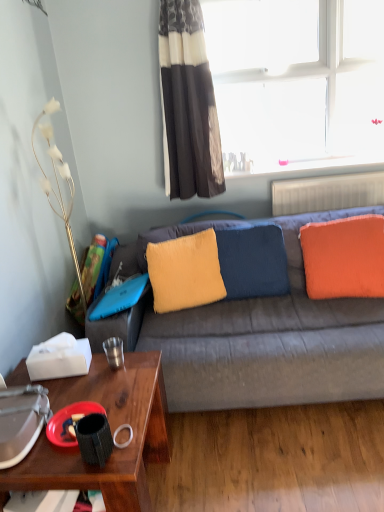
This screenshot has height=512, width=384. Describe the element at coordinates (188, 104) in the screenshot. I see `black and white striped curtain at upper center` at that location.

Locate an element on the screen. The width and height of the screenshot is (384, 512). black textured coffee cup at lower left, the first coffee cup in the front-to-back sequence is located at coordinates (94, 438).

Describe the element at coordinates (327, 193) in the screenshot. I see `white plastic radiator at upper right` at that location.

The height and width of the screenshot is (512, 384). What do you see at coordinates (253, 261) in the screenshot? I see `velvety yellow pillow at center, which appears as the 2th pillow when viewed from the left` at bounding box center [253, 261].

How much space does orange soft cushion at right, marked as the 3th pillow in a left-to-right arrangement, occupy horizontally?

The width of orange soft cushion at right, marked as the 3th pillow in a left-to-right arrangement, is 4.92 inches.

Where is `black and white striped curtain at upper center`? The width and height of the screenshot is (384, 512). black and white striped curtain at upper center is located at coordinates (188, 104).

Is transparent glass window at upper right positioned in front of black textured coffee cup at lower left, arranged as the 2th coffee cup when viewed from the back?

No, transparent glass window at upper right is behind black textured coffee cup at lower left, arranged as the 2th coffee cup when viewed from the back.

Is the surface of transparent glass window at upper right in direct contact with black textured coffee cup at lower left, the first coffee cup in the bottom-to-top sequence?

There is a gap between transparent glass window at upper right and black textured coffee cup at lower left, the first coffee cup in the bottom-to-top sequence.

This screenshot has height=512, width=384. I want to click on the 2nd coffee cup in front when counting from the transparent glass window at upper right, so click(x=94, y=438).

How many degrees apart are the facing directions of black and white striped curtain at upper center and black textured coffee cup at lower left, the first coffee cup in the bottom-to-top sequence?

black and white striped curtain at upper center and black textured coffee cup at lower left, the first coffee cup in the bottom-to-top sequence, are facing 86.9 degrees away from each other.

Relative to black textured coffee cup at lower left, arranged as the 2th coffee cup when viewed from the back, is black and white striped curtain at upper center in front or behind?

black and white striped curtain at upper center is positioned farther from the viewer than black textured coffee cup at lower left, arranged as the 2th coffee cup when viewed from the back.

From the image's perspective, which is below, black and white striped curtain at upper center or black textured coffee cup at lower left, which is counted as the second coffee cup, starting from the top?

black textured coffee cup at lower left, which is counted as the second coffee cup, starting from the top, from the image's perspective.

Which is more distant, [172,9] or [91,448]?

Point [172,9]

The height and width of the screenshot is (512, 384). Identify the location of curtain lying on the right of metallic silver cup at lower left, the 1th coffee cup positioned from the back. (188, 104).

Is metallic silver cup at lower left, the 1th coffee cup positioned from the back, next to black and white striped curtain at upper center and touching it?

No, metallic silver cup at lower left, the 1th coffee cup positioned from the back, is not in contact with black and white striped curtain at upper center.

Is metallic silver cup at lower left, the first coffee cup from the top, oriented away from black and white striped curtain at upper center?

metallic silver cup at lower left, the first coffee cup from the top, does not have its back to black and white striped curtain at upper center.

Between metallic silver cup at lower left, marked as the 2th coffee cup in a front-to-back arrangement, and black and white striped curtain at upper center, which one has less height?

metallic silver cup at lower left, marked as the 2th coffee cup in a front-to-back arrangement.

Which object is wider, black textured coffee cup at lower left, which is counted as the second coffee cup, starting from the top, or transparent glass window at upper right?

black textured coffee cup at lower left, which is counted as the second coffee cup, starting from the top.

Who is taller, black textured coffee cup at lower left, which is counted as the second coffee cup, starting from the top, or transparent glass window at upper right?

With more height is transparent glass window at upper right.

From the image's perspective, which one is positioned lower, black textured coffee cup at lower left, the first coffee cup in the bottom-to-top sequence, or transparent glass window at upper right?

black textured coffee cup at lower left, the first coffee cup in the bottom-to-top sequence, is shown below in the image.

Is transparent glass window at upper right surrounded by black textured coffee cup at lower left, which is counted as the second coffee cup, starting from the top?

Definitely not — transparent glass window at upper right is not inside black textured coffee cup at lower left, which is counted as the second coffee cup, starting from the top.

Is point (378, 290) closer to camera compared to point (153, 259)?

Yes, point (378, 290) is in front of point (153, 259).

Is orange soft cushion at right, marked as the 3th pillow in a left-to-right arrangement, shorter than fuzzy yellow pillow at center, marked as the 1th pillow in a left-to-right arrangement?

No.

Is orange soft cushion at right, marked as the 3th pillow in a left-to-right arrangement, completely or partially outside of fuzzy yellow pillow at center, marked as the 1th pillow in a left-to-right arrangement?

That's correct, orange soft cushion at right, marked as the 3th pillow in a left-to-right arrangement, is outside of fuzzy yellow pillow at center, marked as the 1th pillow in a left-to-right arrangement.

How different are the orientations of orange soft cushion at right, the 1th pillow viewed from the right, and fuzzy yellow pillow at center, arranged as the third pillow when viewed from the right, in degrees?

30.3 degrees separate the facing orientations of orange soft cushion at right, the 1th pillow viewed from the right, and fuzzy yellow pillow at center, arranged as the third pillow when viewed from the right.

Visually, is white metallic lamp at left positioned to the left or to the right of fuzzy yellow pillow at center, arranged as the third pillow when viewed from the right?

white metallic lamp at left is positioned on fuzzy yellow pillow at center, arranged as the third pillow when viewed from the right,'s left side.

From the picture: What's the angular difference between white metallic lamp at left and fuzzy yellow pillow at center, marked as the 1th pillow in a left-to-right arrangement,'s facing directions?

72.5 degrees separate the facing orientations of white metallic lamp at left and fuzzy yellow pillow at center, marked as the 1th pillow in a left-to-right arrangement.

Is white metallic lamp at left bigger or smaller than fuzzy yellow pillow at center, arranged as the third pillow when viewed from the right?

white metallic lamp at left is bigger than fuzzy yellow pillow at center, arranged as the third pillow when viewed from the right.

Which is nearer, (54, 110) or (158, 283)?

Point (54, 110) is farther from the camera than point (158, 283).

From the image's perspective, is transparent glass window at upper right below white metallic lamp at left?

No.

Does transparent glass window at upper right have a larger size compared to white metallic lamp at left?

Yes.

From the picture: Is the surface of transparent glass window at upper right in direct contact with white metallic lamp at left?

No, transparent glass window at upper right is not in contact with white metallic lamp at left.

Does point (277, 58) lie behind point (72, 250)?

Yes, point (277, 58) is behind point (72, 250).

At what (x,y) coordinates should I click in order to perform the action: click on window that is behind the black textured coffee cup at lower left, the first coffee cup in the bottom-to-top sequence. Please return your answer as a coordinate pair (x, y). The image size is (384, 512). Looking at the image, I should click on (295, 78).

Where is `the 1st coffee cup counting from the left of the black and white striped curtain at upper center`? This screenshot has width=384, height=512. the 1st coffee cup counting from the left of the black and white striped curtain at upper center is located at coordinates (94, 438).

Estimate the real-world distances between objects in this image. Which object is further from white plastic radiator at upper right, black and white striped curtain at upper center or fuzzy yellow pillow at center, marked as the 1th pillow in a left-to-right arrangement?

fuzzy yellow pillow at center, marked as the 1th pillow in a left-to-right arrangement.

When comparing their distances from orange soft cushion at right, marked as the 3th pillow in a left-to-right arrangement, does black textured coffee cup at lower left, the first coffee cup in the front-to-back sequence, or transparent glass window at upper right seem closer?

Answer: The object closer to orange soft cushion at right, marked as the 3th pillow in a left-to-right arrangement, is transparent glass window at upper right.

Considering their positions, is metallic silver cup at lower left, the 1th coffee cup positioned from the back, positioned further to white metallic lamp at left than velvety yellow pillow at center, which is the 2th pillow in right-to-left order?

Based on the image, velvety yellow pillow at center, which is the 2th pillow in right-to-left order, appears to be further to white metallic lamp at left.

Estimate the real-world distances between objects in this image. Which object is further from transparent glass window at upper right, velvety yellow pillow at center, which is the 2th pillow in right-to-left order, or orange soft cushion at right, marked as the 3th pillow in a left-to-right arrangement?

Among the two, orange soft cushion at right, marked as the 3th pillow in a left-to-right arrangement, is located further to transparent glass window at upper right.

Which object lies nearer to the anchor point fuzzy yellow pillow at center, arranged as the third pillow when viewed from the right, white plastic radiator at upper right or white metallic lamp at left?

white metallic lamp at left is closer to fuzzy yellow pillow at center, arranged as the third pillow when viewed from the right.

Considering their positions, is velvety yellow pillow at center, which is the 2th pillow in right-to-left order, positioned further to black textured coffee cup at lower left, which is counted as the second coffee cup, starting from the top, than metallic silver cup at lower left, marked as the 2th coffee cup in a front-to-back arrangement?

Among the two, velvety yellow pillow at center, which is the 2th pillow in right-to-left order, is located further to black textured coffee cup at lower left, which is counted as the second coffee cup, starting from the top.

Estimate the real-world distances between objects in this image. Which object is further from black textured coffee cup at lower left, which is counted as the second coffee cup, starting from the top, orange soft cushion at right, marked as the 3th pillow in a left-to-right arrangement, or velvety yellow pillow at center, which appears as the 2th pillow when viewed from the left?

orange soft cushion at right, marked as the 3th pillow in a left-to-right arrangement, lies further to black textured coffee cup at lower left, which is counted as the second coffee cup, starting from the top, than the other object.

Considering their positions, is velvety yellow pillow at center, which appears as the 2th pillow when viewed from the left, positioned further to fuzzy yellow pillow at center, arranged as the third pillow when viewed from the right, than black textured coffee cup at lower left, which is counted as the second coffee cup, starting from the top?

Based on the image, black textured coffee cup at lower left, which is counted as the second coffee cup, starting from the top, appears to be further to fuzzy yellow pillow at center, arranged as the third pillow when viewed from the right.

Find the location of `desk between black textured coffee cup at lower left, which is counted as the second coffee cup, starting from the top, and velvety yellow pillow at center, which is the 2th pillow in right-to-left order, from front to back`. desk between black textured coffee cup at lower left, which is counted as the second coffee cup, starting from the top, and velvety yellow pillow at center, which is the 2th pillow in right-to-left order, from front to back is located at coordinates (112, 433).

The height and width of the screenshot is (512, 384). What are the coordinates of `pillow between black and white striped curtain at upper center and velvety yellow pillow at center, which is the 2th pillow in right-to-left order, in the vertical direction` in the screenshot? It's located at (344, 257).

Locate an element on the screen. desk between black textured coffee cup at lower left, the first coffee cup in the front-to-back sequence, and fuzzy yellow pillow at center, marked as the 1th pillow in a left-to-right arrangement, along the z-axis is located at coordinates (112, 433).

At what (x,y) coordinates should I click in order to perform the action: click on radiator that lies between transparent glass window at upper right and velvety yellow pillow at center, which appears as the 2th pillow when viewed from the left, from top to bottom. Please return your answer as a coordinate pair (x, y). The height and width of the screenshot is (512, 384). Looking at the image, I should click on (327, 193).